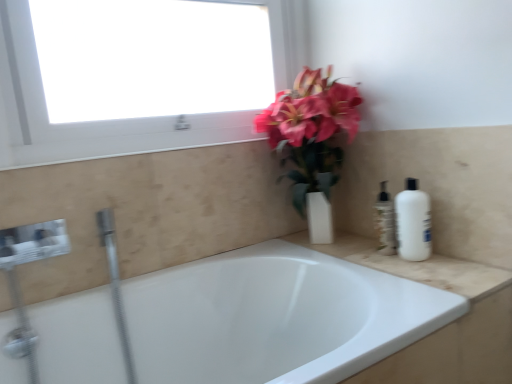
Find the location of `vacant space situated on the left part of translucent plastic soap dispenser at right`. vacant space situated on the left part of translucent plastic soap dispenser at right is located at coordinates (356, 253).